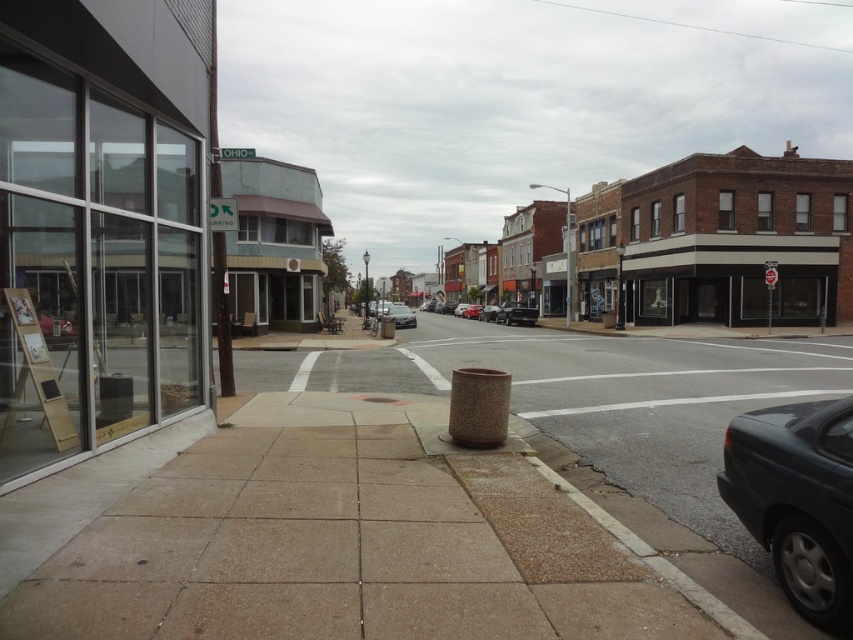
You are a delivery person trying to decide which building to deliver a package to. The package is meant for the taller building. Which one should you choose between the brick building at center and the matte white building at center?

The brick building at center is much taller than the matte white building at center, so you should choose the brick building at center.

You are a delivery person trying to determine the best path to avoid the clear glass storefront at left and the dark gray metallic car at lower right. Since you need to move along the sidewalk, which object should you go around first?

The clear glass storefront at left is bigger than the dark gray metallic car at lower right, so you should go around the clear glass storefront at left first to ensure there is enough space for your delivery vehicle.